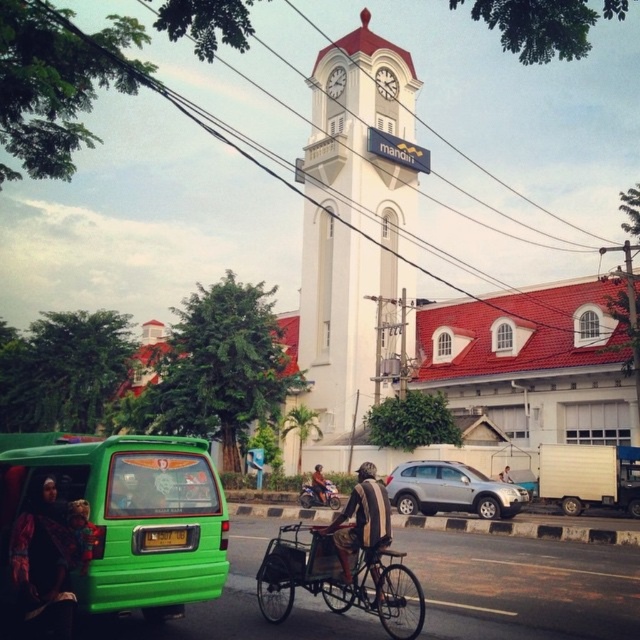
Question: Considering the relative positions of green matte van at lower left and dark fabric headscarf at lower left in the image provided, where is green matte van at lower left located with respect to dark fabric headscarf at lower left?

Choices:
 (A) below
 (B) above

Answer: (B)

Question: Considering the real-world distances, which object is farthest from the white smooth clock tower at center?

Choices:
 (A) metallic silver bicycle at center
 (B) orange fabric helmet at center

Answer: (A)

Question: Which of the following is the farthest from the observer?

Choices:
 (A) (x=84, y=564)
 (B) (x=321, y=486)

Answer: (B)

Question: Considering the real-world distances, which object is closest to the dark fabric headscarf at lower left?

Choices:
 (A) green matte van at lower left
 (B) silver metallic suv at center
 (C) orange fabric helmet at center
 (D) metallic silver bicycle at center

Answer: (A)

Question: Considering the relative positions of dark fabric headscarf at lower left and orange fabric helmet at center in the image provided, where is dark fabric headscarf at lower left located with respect to orange fabric helmet at center?

Choices:
 (A) above
 (B) below

Answer: (A)

Question: Does dark fabric headscarf at lower left appear on the left side of metallic silver bicycle at center?

Choices:
 (A) no
 (B) yes

Answer: (B)